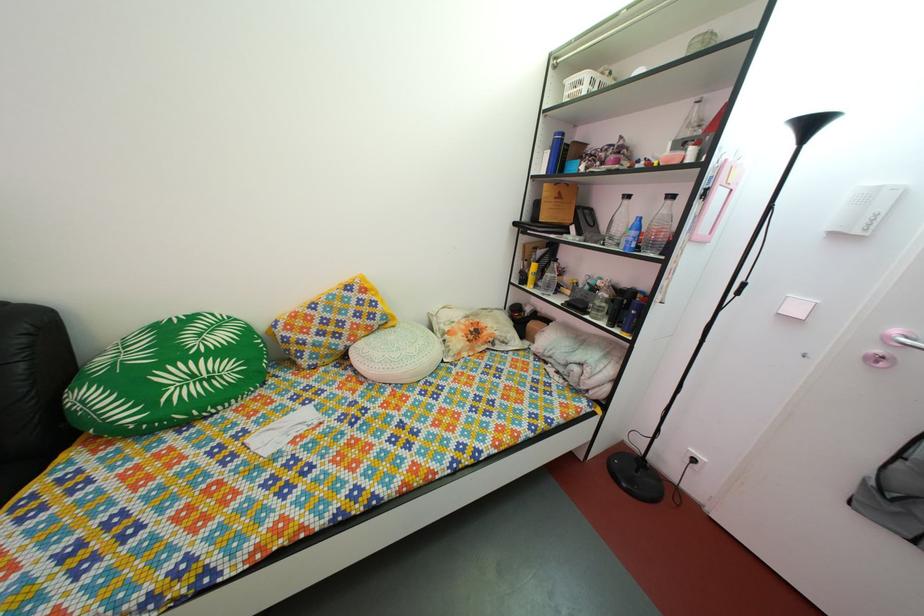
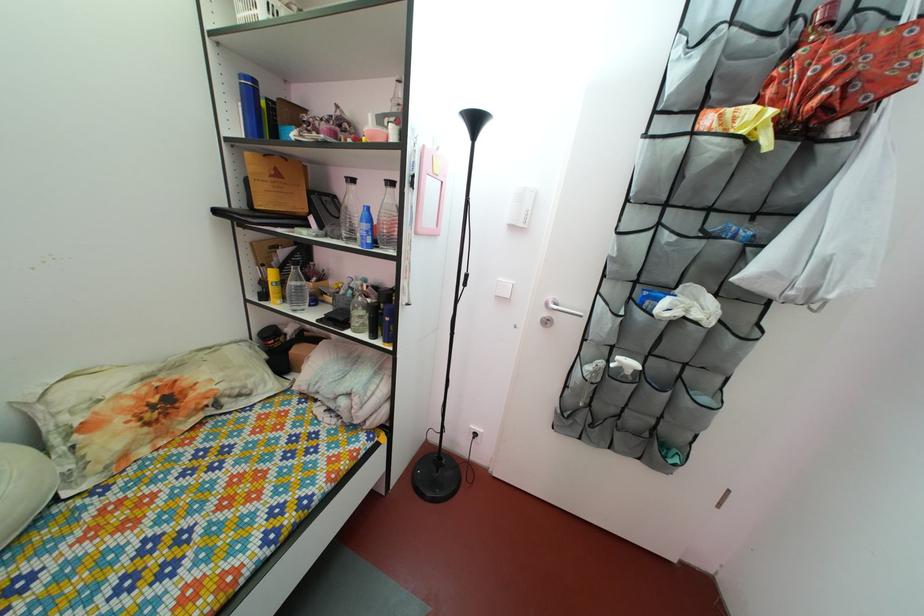
Locate, in the second image, the point that corresponds to point (626, 253) in the first image.

(363, 248)